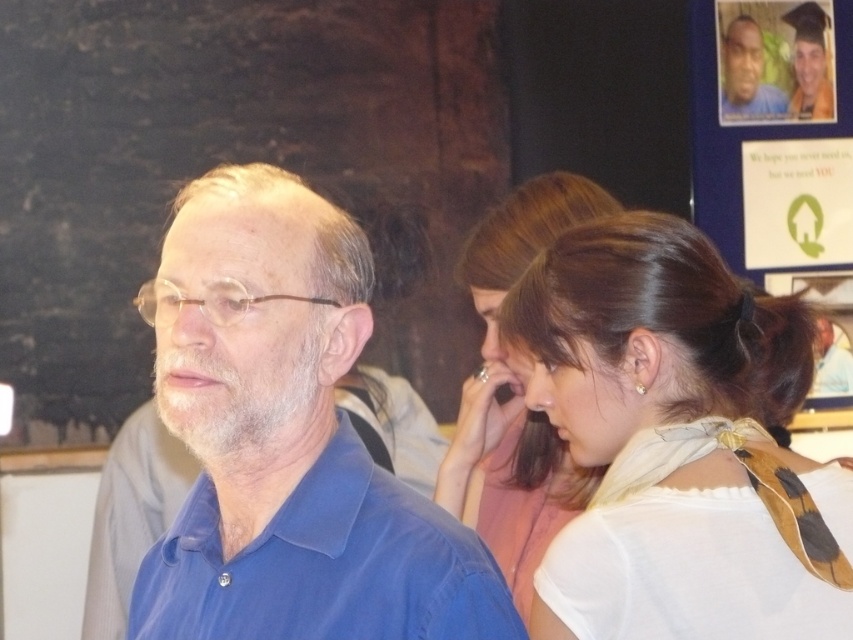
Question: Is the position of white silk scarf at center less distant than that of smooth skin face at upper right?

Choices:
 (A) no
 (B) yes

Answer: (B)

Question: Which object appears farthest from the camera in this image?

Choices:
 (A) blue smooth shirt at center
 (B) white silk scarf at upper right

Answer: (B)

Question: Can you confirm if gray matte hair at upper right is positioned above matte skin ear at center?

Choices:
 (A) no
 (B) yes

Answer: (B)

Question: Does smooth skin face at upper right appear on the left side of matte skin ear at center?

Choices:
 (A) no
 (B) yes

Answer: (A)

Question: Among these objects, which one is nearest to the camera?

Choices:
 (A) blue smooth shirt at center
 (B) goldearring at right
 (C) smooth skin face at upper right
 (D) gray matte hair at upper right

Answer: (A)

Question: Which point appears closest to the camera in this image?

Choices:
 (A) (161, 269)
 (B) (633, 340)
 (C) (819, 368)
 (D) (146, 566)

Answer: (A)